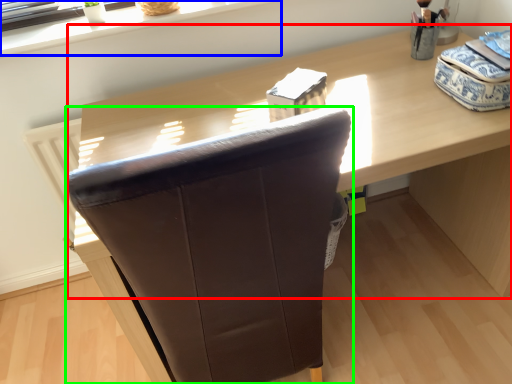
Question: Which object is the closest to the computer desk (highlighted by a red box)? Choose among these: window sill (highlighted by a blue box) or chair (highlighted by a green box).

Choices:
 (A) window sill
 (B) chair

Answer: (A)